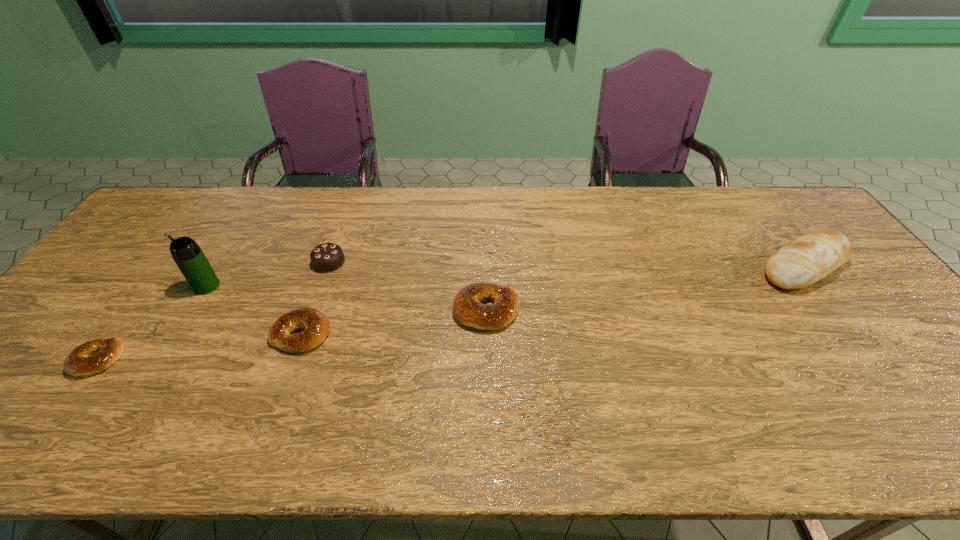
This screenshot has width=960, height=540. What are the coordinates of `the fifth object from right to left` in the screenshot? It's located at (190, 259).

Find the location of a particular element. free location located on the back of the leftmost object is located at coordinates (158, 275).

The image size is (960, 540). Find the location of `vacant space located 0.360m on the back of the second shortest bagel`. vacant space located 0.360m on the back of the second shortest bagel is located at coordinates (339, 227).

Where is `vacant area situated 0.340m on the back of the tallest bagel`? vacant area situated 0.340m on the back of the tallest bagel is located at coordinates (485, 215).

Find the location of a particular element. This screenshot has height=540, width=960. free location located on the left of the bread is located at coordinates (685, 267).

This screenshot has width=960, height=540. I want to click on free space located 0.050m on the right of the chocolate cake, so click(x=362, y=262).

The width and height of the screenshot is (960, 540). What are the coordinates of `free spot located from the spout of the second object from left to right` in the screenshot? It's located at (144, 286).

Locate an element on the screen. The height and width of the screenshot is (540, 960). free location located 0.070m from the spout of the second object from left to right is located at coordinates point(169,286).

Find the location of `free spot located from the spout of the second object from left to right`. free spot located from the spout of the second object from left to right is located at coordinates click(105, 286).

At what (x,y) coordinates should I click in order to perform the action: click on object that is at the near edge. Please return your answer as a coordinate pair (x, y). Looking at the image, I should click on [x=95, y=356].